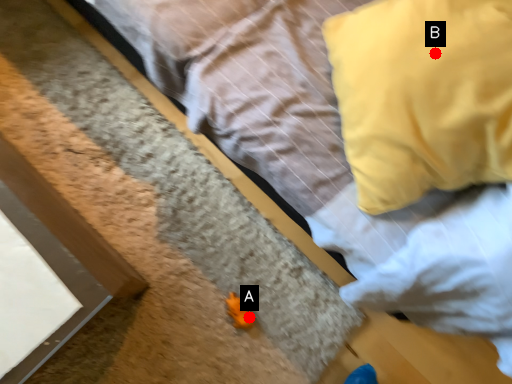
Question: Two points are circled on the image, labeled by A and B beside each circle. Which of the following is the farthest from the observer?

Choices:
 (A) A is further
 (B) B is further

Answer: (A)